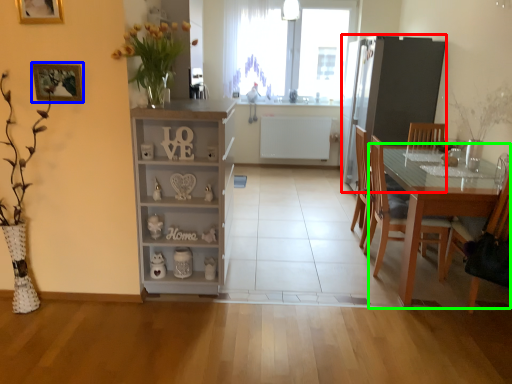
Question: Which is nearer to the appliance (highlighted by a red box)? picture frame (highlighted by a blue box) or table (highlighted by a green box).

Choices:
 (A) picture frame
 (B) table

Answer: (B)